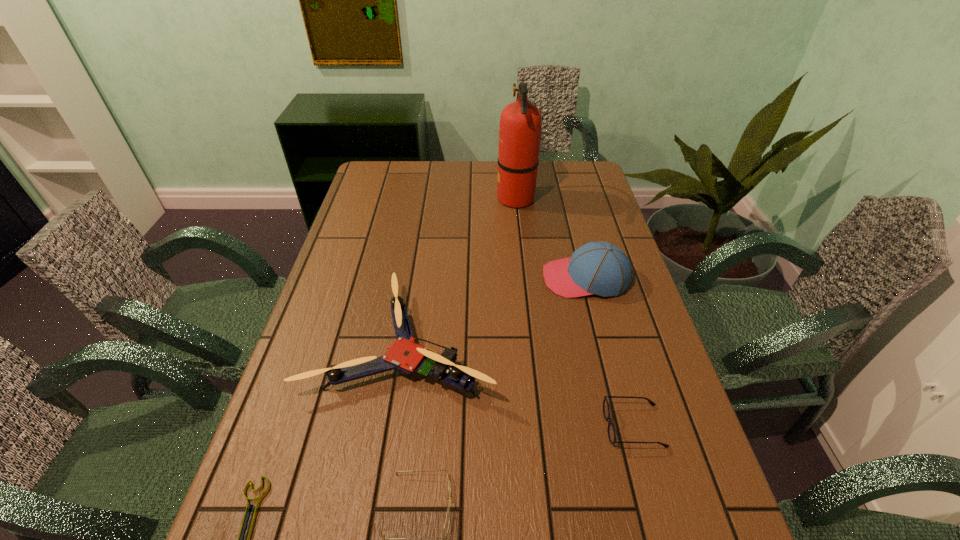
I want to click on vacant space that satisfies the following two spatial constraints: 1. on the front-facing side of the baseball cap; 2. on the front side of the drone, so click(602, 342).